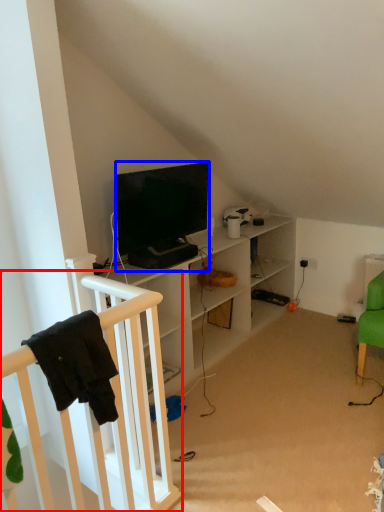
Question: Which object appears farthest to the camera in this image, infant bed (highlighted by a red box) or television (highlighted by a blue box)?

Choices:
 (A) infant bed
 (B) television

Answer: (B)